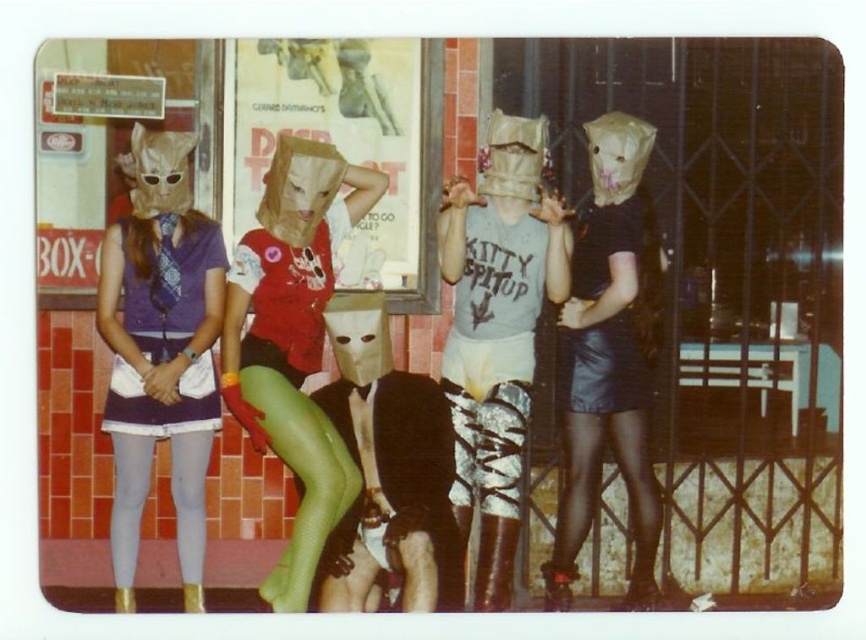
Question: Which point is closer to the camera?

Choices:
 (A) (541, 168)
 (B) (637, 560)
 (C) (622, 403)

Answer: (A)

Question: Is black leather skirt at right in front of black leather stockings at lower right?

Choices:
 (A) no
 (B) yes

Answer: (B)

Question: Which of the following is the farthest from the observer?

Choices:
 (A) (629, 467)
 (B) (140, 477)

Answer: (A)

Question: Does black leather skirt at right appear on the right side of light gray tights at lower left?

Choices:
 (A) yes
 (B) no

Answer: (A)

Question: Which point appears farthest from the camera in this image?

Choices:
 (A) (470, 305)
 (B) (642, 234)
 (C) (585, 419)
 (D) (282, 269)

Answer: (C)

Question: Does green mesh tights at center have a smaller size compared to light gray tights at lower left?

Choices:
 (A) yes
 (B) no

Answer: (B)